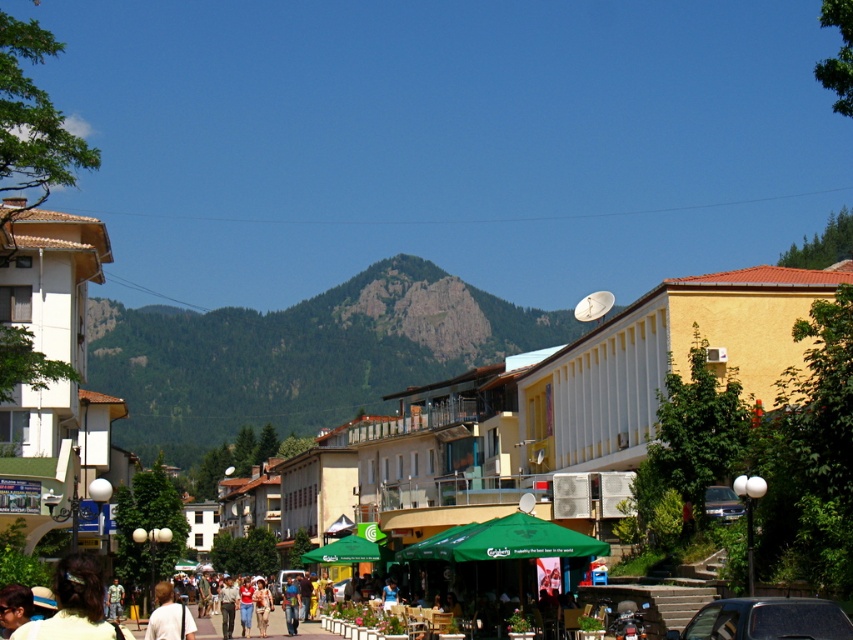
You are a photographer standing at the center of the street. You notice a person with light brown hair at lower left. Where should you position yourself to capture their hair in the frame?

The light brown hair at lower left is located at point [74,604], so you should position yourself to the lower left to include the light brown hair at lower left in your frame.

From the picture: You are a photographer standing in the middle of the street. You notice two people with light brown hair at lower left and light brown hair at center. Which person with light brown hair is positioned higher up in the image?

The light brown hair at lower left is positioned higher up in the image than the light brown hair at center, as it is located above it.